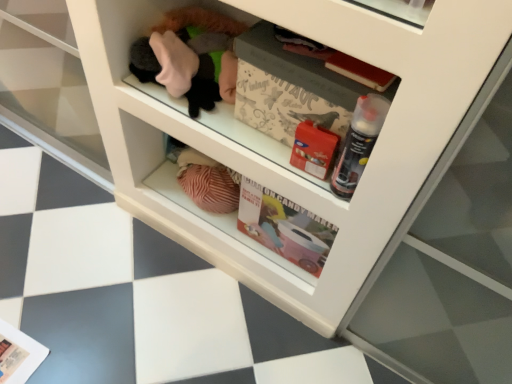
Question: Considering the relative sizes of translucent plastic spray can at center right and matte paper magazine at lower left, the first magazine positioned from the back, in the image provided, is translucent plastic spray can at center right smaller than matte paper magazine at lower left, the first magazine positioned from the back,?

Choices:
 (A) no
 (B) yes

Answer: (A)

Question: Is translucent plastic spray can at center right taller than matte paper magazine at lower left, which ranks as the first magazine in left-to-right order?

Choices:
 (A) yes
 (B) no

Answer: (A)

Question: Considering the relative positions of translucent plastic spray can at center right and matte paper magazine at lower left, the first magazine positioned from the back, in the image provided, is translucent plastic spray can at center right to the right of matte paper magazine at lower left, the first magazine positioned from the back, from the viewer's perspective?

Choices:
 (A) yes
 (B) no

Answer: (A)

Question: Is translucent plastic spray can at center right facing away from matte paper magazine at lower left, which appears as the second magazine when viewed from the top?

Choices:
 (A) yes
 (B) no

Answer: (B)

Question: Can you confirm if translucent plastic spray can at center right is shorter than matte paper magazine at lower left, placed as the 1th magazine when sorted from bottom to top?

Choices:
 (A) yes
 (B) no

Answer: (B)

Question: Is translucent plastic spray can at center right surrounding matte paper magazine at lower left, which ranks as the first magazine in left-to-right order?

Choices:
 (A) no
 (B) yes

Answer: (A)

Question: Is white paper magazine at center, the 1th magazine in the right-to-left sequence, next to matte paper magazine at lower left, which appears as the second magazine when viewed from the top?

Choices:
 (A) no
 (B) yes

Answer: (A)

Question: Could you tell me if white paper magazine at center, which is the 2th magazine in left-to-right order, is turned towards matte paper magazine at lower left, placed as the 1th magazine when sorted from bottom to top?

Choices:
 (A) yes
 (B) no

Answer: (B)

Question: Does white paper magazine at center, the 1th magazine in the right-to-left sequence, have a greater height compared to matte paper magazine at lower left, which ranks as the first magazine in left-to-right order?

Choices:
 (A) yes
 (B) no

Answer: (A)

Question: Considering the relative positions of white paper magazine at center, placed as the 1th magazine when sorted from top to bottom, and matte paper magazine at lower left, which appears as the second magazine when viewed from the top, in the image provided, is white paper magazine at center, placed as the 1th magazine when sorted from top to bottom, to the right of matte paper magazine at lower left, which appears as the second magazine when viewed from the top, from the viewer's perspective?

Choices:
 (A) yes
 (B) no

Answer: (A)

Question: From the image's perspective, is white paper magazine at center, the 2th magazine when ordered from bottom to top, beneath matte paper magazine at lower left, placed as the 1th magazine when sorted from bottom to top?

Choices:
 (A) yes
 (B) no

Answer: (B)

Question: Can you confirm if white paper magazine at center, placed as the 1th magazine when sorted from top to bottom, is positioned to the left of matte paper magazine at lower left, which ranks as the first magazine in left-to-right order?

Choices:
 (A) no
 (B) yes

Answer: (A)